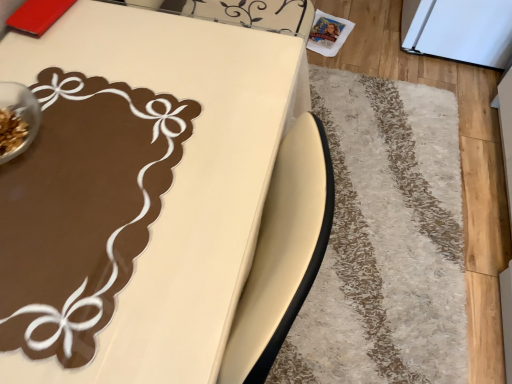
Question: Is matte brown table at upper left taller than white shaggy rug at lower right?

Choices:
 (A) yes
 (B) no

Answer: (A)

Question: Is matte brown table at upper left turned away from white shaggy rug at lower right?

Choices:
 (A) no
 (B) yes

Answer: (A)

Question: Is matte brown table at upper left placed right next to white shaggy rug at lower right?

Choices:
 (A) no
 (B) yes

Answer: (A)

Question: From a real-world perspective, does matte brown table at upper left stand above white shaggy rug at lower right?

Choices:
 (A) no
 (B) yes

Answer: (B)

Question: Is matte brown table at upper left positioned beyond the bounds of white shaggy rug at lower right?

Choices:
 (A) yes
 (B) no

Answer: (A)

Question: Does matte brown table at upper left have a greater width compared to white shaggy rug at lower right?

Choices:
 (A) yes
 (B) no

Answer: (B)

Question: From the image's perspective, does white shaggy rug at lower right appear higher than matte brown table at upper left?

Choices:
 (A) yes
 (B) no

Answer: (A)

Question: Is white shaggy rug at lower right in front of matte brown table at upper left?

Choices:
 (A) no
 (B) yes

Answer: (A)

Question: Is white shaggy rug at lower right further to the viewer compared to matte brown table at upper left?

Choices:
 (A) no
 (B) yes

Answer: (B)

Question: Are white shaggy rug at lower right and matte brown table at upper left making contact?

Choices:
 (A) no
 (B) yes

Answer: (A)

Question: Is white shaggy rug at lower right aimed at matte brown table at upper left?

Choices:
 (A) no
 (B) yes

Answer: (A)

Question: Considering the relative positions of white shaggy rug at lower right and matte brown table at upper left in the image provided, is white shaggy rug at lower right to the right of matte brown table at upper left from the viewer's perspective?

Choices:
 (A) no
 (B) yes

Answer: (B)

Question: From a real-world perspective, is matte brown table at upper left positioned above or below white shaggy rug at lower right?

Choices:
 (A) above
 (B) below

Answer: (A)